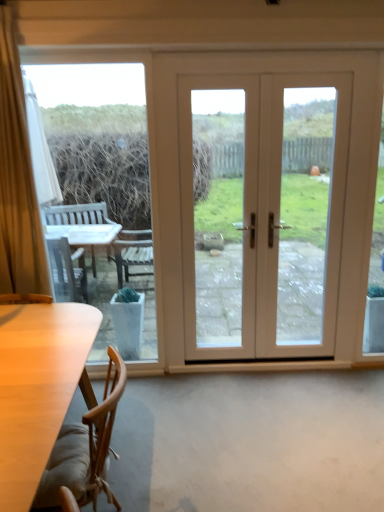
Question: Does transparent glass table at left have a smaller size compared to white glossy door at center?

Choices:
 (A) no
 (B) yes

Answer: (B)

Question: From a real-world perspective, is transparent glass table at left physically above white glossy door at center?

Choices:
 (A) no
 (B) yes

Answer: (A)

Question: Can you confirm if transparent glass table at left is thinner than white glossy door at center?

Choices:
 (A) yes
 (B) no

Answer: (A)

Question: Does transparent glass table at left contain white glossy door at center?

Choices:
 (A) no
 (B) yes

Answer: (A)

Question: Does transparent glass table at left have a greater width compared to white glossy door at center?

Choices:
 (A) no
 (B) yes

Answer: (A)

Question: Does transparent glass table at left come in front of white glossy door at center?

Choices:
 (A) yes
 (B) no

Answer: (A)

Question: Is transparent glass table at left not within wooden chair at lower left?

Choices:
 (A) yes
 (B) no

Answer: (A)

Question: Would you say transparent glass table at left contains wooden chair at lower left?

Choices:
 (A) no
 (B) yes

Answer: (A)

Question: Considering the relative sizes of transparent glass table at left and wooden chair at lower left in the image provided, is transparent glass table at left bigger than wooden chair at lower left?

Choices:
 (A) yes
 (B) no

Answer: (B)

Question: Does transparent glass table at left appear on the left side of wooden chair at lower left?

Choices:
 (A) yes
 (B) no

Answer: (A)

Question: Can you confirm if transparent glass table at left is wider than wooden chair at lower left?

Choices:
 (A) no
 (B) yes

Answer: (A)

Question: Is transparent glass table at left facing away from wooden chair at lower left?

Choices:
 (A) yes
 (B) no

Answer: (B)

Question: From the image's perspective, is white glossy door at center beneath transparent glass table at left?

Choices:
 (A) no
 (B) yes

Answer: (A)